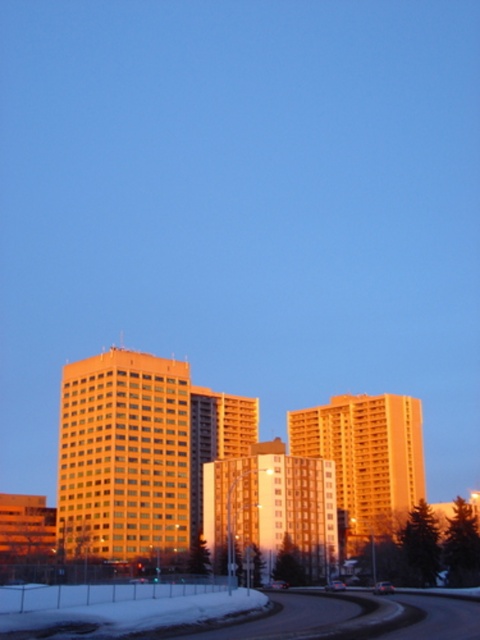
In the scene shown: Which of these two, golden glass building at center or orange glass building at center, stands taller?

With more height is golden glass building at center.

Can you confirm if golden glass building at center is positioned to the left of orange glass building at center?

Incorrect, golden glass building at center is not on the left side of orange glass building at center.

Between point (313, 449) and point (324, 481), which one is positioned in front?

Point (324, 481) is more forward.

Locate an element on the screen. golden glass building at center is located at coordinates (365, 458).

Which of these two, snowy asphalt highway at lower center or orange glass building at center, stands taller?

Standing taller between the two is snowy asphalt highway at lower center.

Is snowy asphalt highway at lower center positioned behind orange glass building at center?

That is False.

Is point (384, 600) farther from viewer compared to point (263, 474)?

No, it is in front of (263, 474).

This screenshot has width=480, height=640. I want to click on snowy asphalt highway at lower center, so click(233, 614).

Which is above, snowy asphalt highway at lower center or golden glass building at center?

snowy asphalt highway at lower center

Identify the location of snowy asphalt highway at lower center. The width and height of the screenshot is (480, 640). (233, 614).